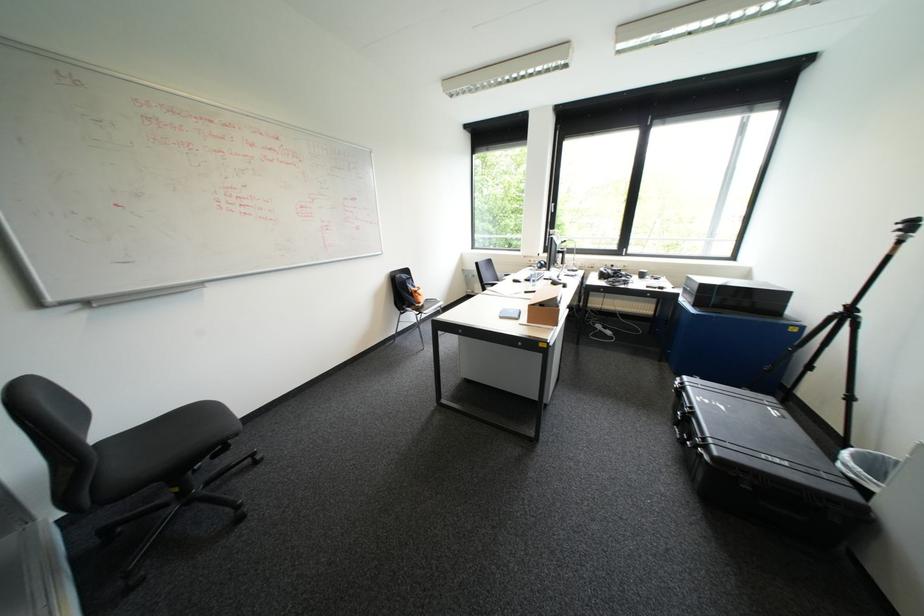
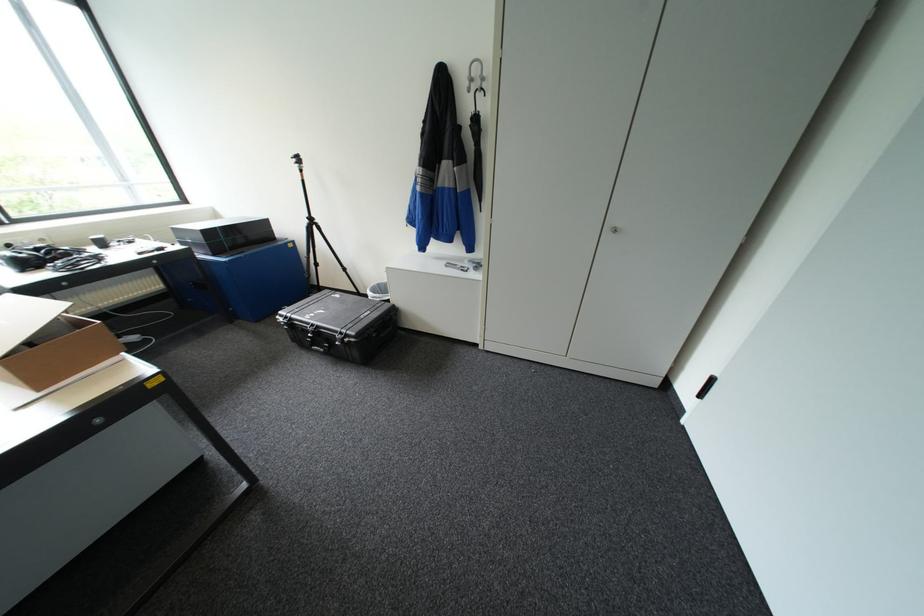
The images are taken continuously from a first-person perspective. In which direction is your viewpoint rotating?

The camera rotated toward right-down.